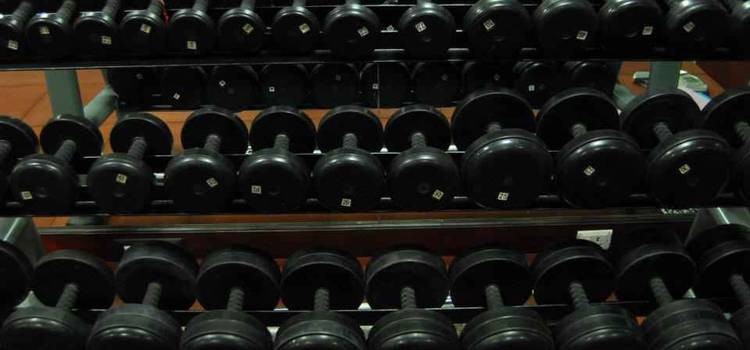
Locate an element on the screen. flooring is located at coordinates (33, 94).